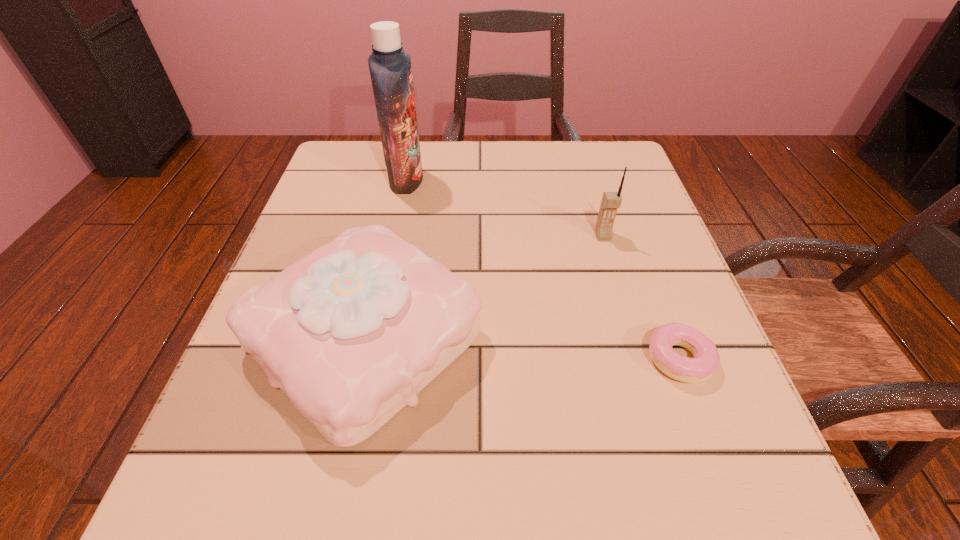
You are a GUI agent. You are given a task and a screenshot of the screen. Output one action in this format:
    pyautogui.click(x=<x>, y=<y>)
    Task: Click on the object positioned at the far edge
    The width and height of the screenshot is (960, 540).
    Given the screenshot: What is the action you would take?
    pyautogui.click(x=390, y=69)

Find the location of `object positioned at the near edge`. object positioned at the near edge is located at coordinates (351, 333).

This screenshot has height=540, width=960. I want to click on shampoo at the left edge, so click(390, 69).

Find the location of a particular element. The image size is (960, 540). cake positioned at the left edge is located at coordinates (351, 333).

Where is `cellular telephone that is at the right edge`? This screenshot has height=540, width=960. cellular telephone that is at the right edge is located at coordinates (611, 201).

You are a GUI agent. You are given a task and a screenshot of the screen. Output one action in this format:
    pyautogui.click(x=<x>, y=<y>)
    Task: Click on the doughnut at the right edge
    This screenshot has width=960, height=540.
    Given the screenshot: What is the action you would take?
    pyautogui.click(x=706, y=360)

Find the location of a particular element. This screenshot has height=540, width=960. object positioned at the far left corner is located at coordinates (390, 69).

Where is `object at the near left corner`? This screenshot has width=960, height=540. object at the near left corner is located at coordinates (351, 333).

What are the coordinates of `vacant space at the far edge of the desktop` in the screenshot? It's located at [547, 191].

Where is `vacant area at the near edge`? This screenshot has width=960, height=540. vacant area at the near edge is located at coordinates (448, 487).